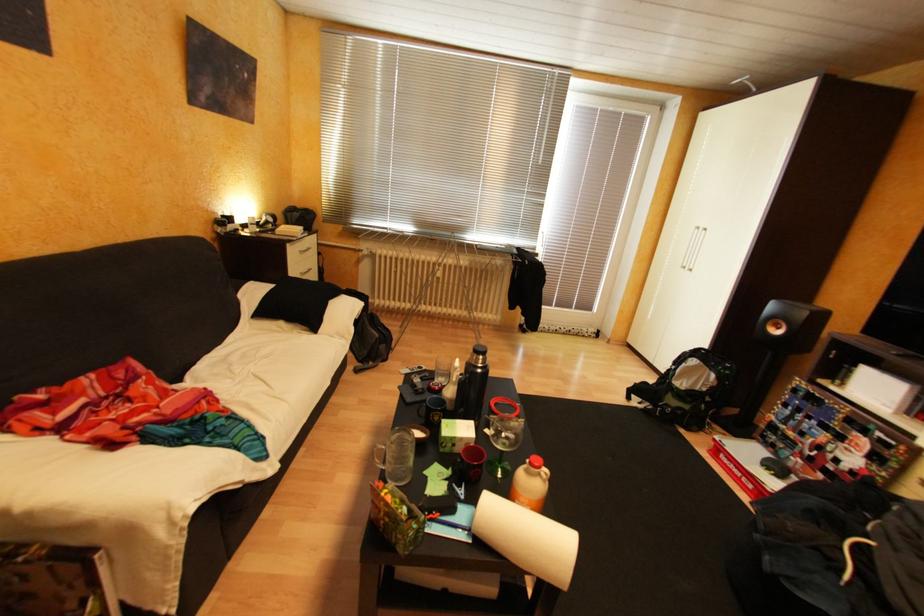
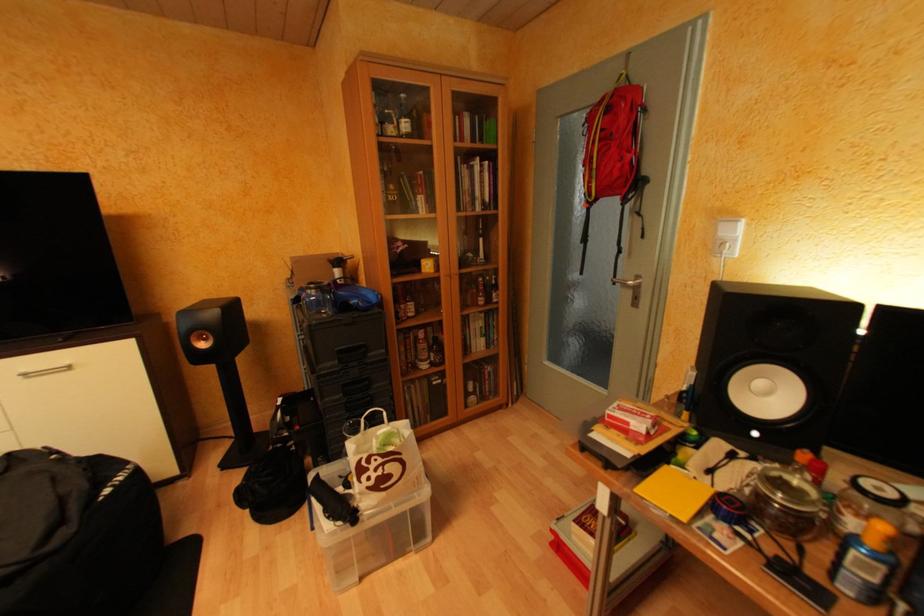
Based on the photo, how did the camera likely rotate?

The camera's rotation is toward right-down.